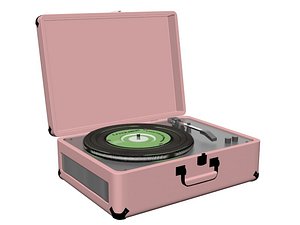
Find the location of a particular element. handle is located at coordinates (195, 183).